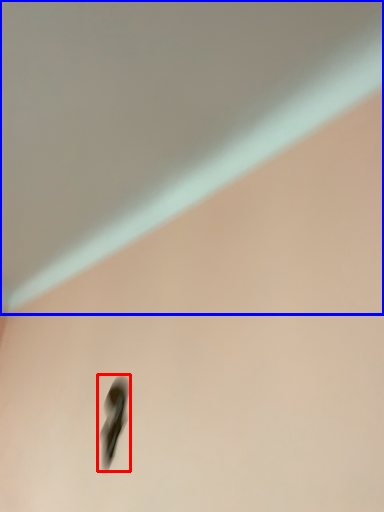
Question: Which object is further to the camera taking this photo, footwear (highlighted by a red box) or backdrop (highlighted by a blue box)?

Choices:
 (A) footwear
 (B) backdrop

Answer: (A)